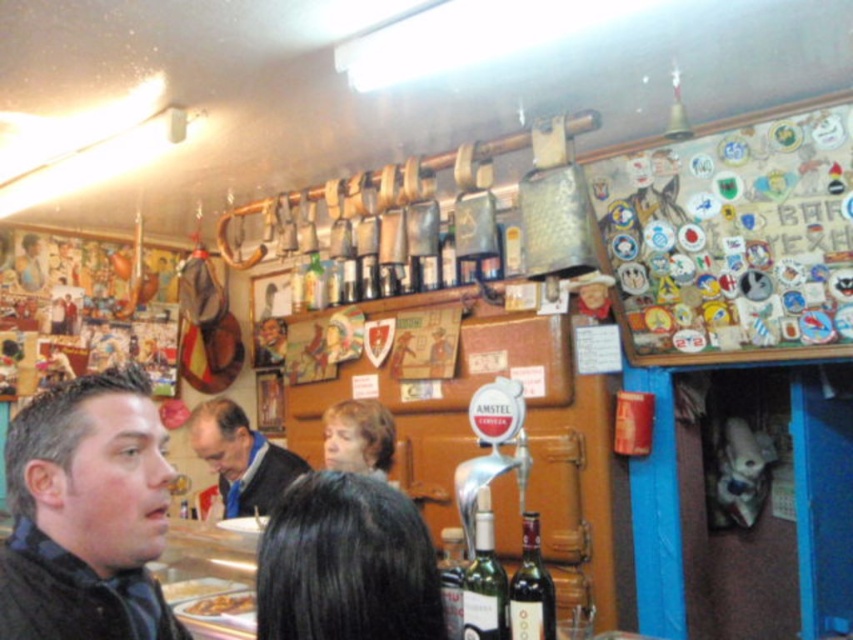
Is green glass bottle at center to the left of dark red glass bottle at center from the viewer's perspective?

Yes, green glass bottle at center is to the left of dark red glass bottle at center.

Between point (505, 627) and point (531, 602), which one is positioned behind?

Point (505, 627)

The width and height of the screenshot is (853, 640). Find the location of `green glass bottle at center`. green glass bottle at center is located at coordinates (485, 586).

Is dark gray sweater at lower left to the right of black hair at center from the viewer's perspective?

In fact, dark gray sweater at lower left is to the left of black hair at center.

Is dark gray sweater at lower left thinner than black hair at center?

Correct, dark gray sweater at lower left's width is less than black hair at center's.

Find the location of `dark gray sweater at lower left`. dark gray sweater at lower left is located at coordinates click(x=86, y=513).

This screenshot has width=853, height=640. What are the coordinates of `dark gray sweater at lower left` in the screenshot? It's located at pos(86,513).

Is blue fabric shirt at center taller than light brown hair at center?

Correct, blue fabric shirt at center is much taller as light brown hair at center.

Is blue fabric shirt at center shorter than light brown hair at center?

No, blue fabric shirt at center is not shorter than light brown hair at center.

The width and height of the screenshot is (853, 640). I want to click on blue fabric shirt at center, so click(x=241, y=458).

Identify the location of blue fabric shirt at center. This screenshot has height=640, width=853. (241, 458).